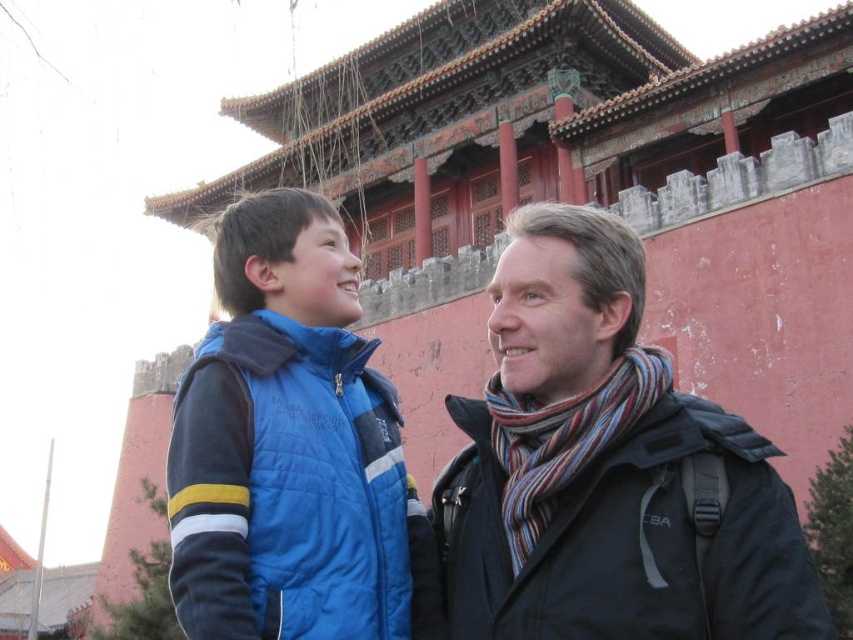
Question: Is dark gray wool scarf at right to the right of blue quilted vest at center from the viewer's perspective?

Choices:
 (A) no
 (B) yes

Answer: (B)

Question: Which object appears closest to the camera in this image?

Choices:
 (A) dark gray wool scarf at right
 (B) blue quilted vest at center

Answer: (A)

Question: Does dark gray wool scarf at right have a smaller size compared to blue quilted vest at center?

Choices:
 (A) yes
 (B) no

Answer: (B)

Question: Is dark gray wool scarf at right in front of blue quilted vest at center?

Choices:
 (A) yes
 (B) no

Answer: (A)

Question: Which of the following is the closest to the observer?

Choices:
 (A) (508, 317)
 (B) (239, 308)

Answer: (A)

Question: Among these points, which one is nearest to the camera?

Choices:
 (A) (207, 506)
 (B) (469, 561)

Answer: (A)